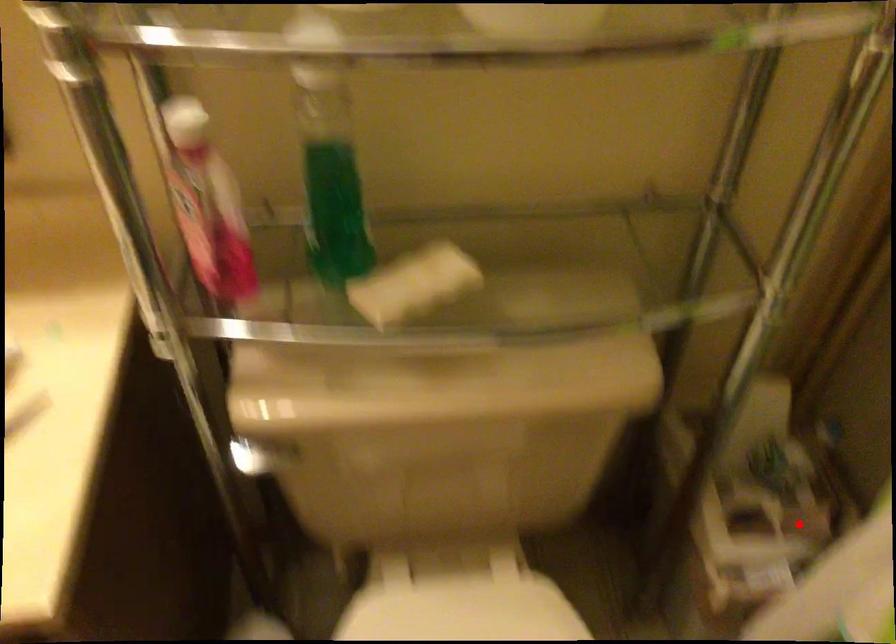
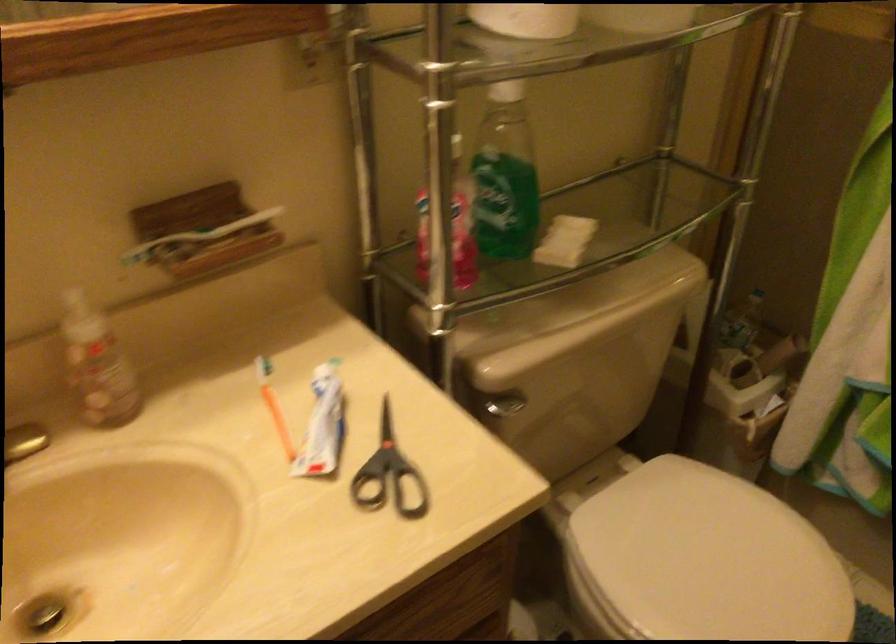
Question: I am providing you with two images of the same scene from different viewpoints. In image1, a red point is highlighted. Considering the same 3D point in image2, which of the following is correct?

Choices:
 (A) It is closer
 (B) It is farther

Answer: (B)